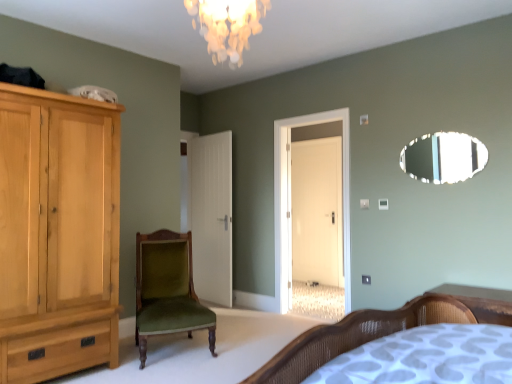
Question: Is wooden bed at lower right shorter than iridescent glass chandelier at upper center?

Choices:
 (A) no
 (B) yes

Answer: (B)

Question: Can you confirm if wooden bed at lower right is thinner than iridescent glass chandelier at upper center?

Choices:
 (A) no
 (B) yes

Answer: (A)

Question: From a real-world perspective, is wooden bed at lower right below iridescent glass chandelier at upper center?

Choices:
 (A) no
 (B) yes

Answer: (B)

Question: Is wooden bed at lower right in contact with iridescent glass chandelier at upper center?

Choices:
 (A) no
 (B) yes

Answer: (A)

Question: From a real-world perspective, is wooden bed at lower right on iridescent glass chandelier at upper center?

Choices:
 (A) no
 (B) yes

Answer: (A)

Question: Considering their positions, is iridescent glass chandelier at upper center located in front of or behind white glossy door at center?

Choices:
 (A) behind
 (B) front

Answer: (B)

Question: From the image's perspective, is iridescent glass chandelier at upper center positioned above or below white glossy door at center?

Choices:
 (A) above
 (B) below

Answer: (A)

Question: Considering the positions of iridescent glass chandelier at upper center and white glossy door at center in the image, is iridescent glass chandelier at upper center bigger or smaller than white glossy door at center?

Choices:
 (A) small
 (B) big

Answer: (B)

Question: Is iridescent glass chandelier at upper center situated inside white glossy door at center or outside?

Choices:
 (A) inside
 (B) outside

Answer: (B)

Question: In terms of width, does green velvet chair at center look wider or thinner when compared to iridescent glass chandelier at upper center?

Choices:
 (A) thin
 (B) wide

Answer: (B)

Question: Considering their positions, is green velvet chair at center located in front of or behind iridescent glass chandelier at upper center?

Choices:
 (A) behind
 (B) front

Answer: (A)

Question: Is point (162, 273) closer or farther from the camera than point (254, 26)?

Choices:
 (A) farther
 (B) closer

Answer: (A)

Question: From the image's perspective, is green velvet chair at center positioned above or below iridescent glass chandelier at upper center?

Choices:
 (A) above
 (B) below

Answer: (B)

Question: Considering the positions of green velvet chair at center and white glossy door at center in the image, is green velvet chair at center wider or thinner than white glossy door at center?

Choices:
 (A) thin
 (B) wide

Answer: (B)

Question: From the image's perspective, relative to white glossy door at center, is green velvet chair at center above or below?

Choices:
 (A) below
 (B) above

Answer: (A)